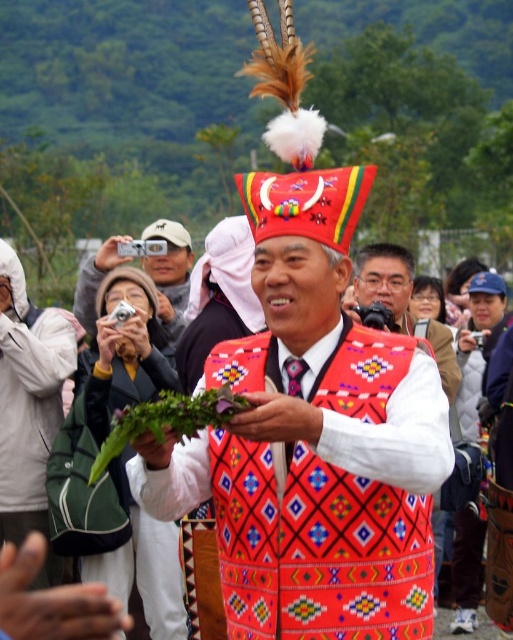
Question: Does red fabric vest at center appear on the left side of matte white camera at center?

Choices:
 (A) yes
 (B) no

Answer: (B)

Question: Does red fabric vest at center appear under matte white camera at center?

Choices:
 (A) no
 (B) yes

Answer: (B)

Question: From the image, what is the correct spatial relationship of red fabric vest at center in relation to matte white camera at center?

Choices:
 (A) below
 (B) above

Answer: (A)

Question: Which point is farther to the camera?

Choices:
 (A) matte white camera at center
 (B) red fabric vest at center

Answer: (A)